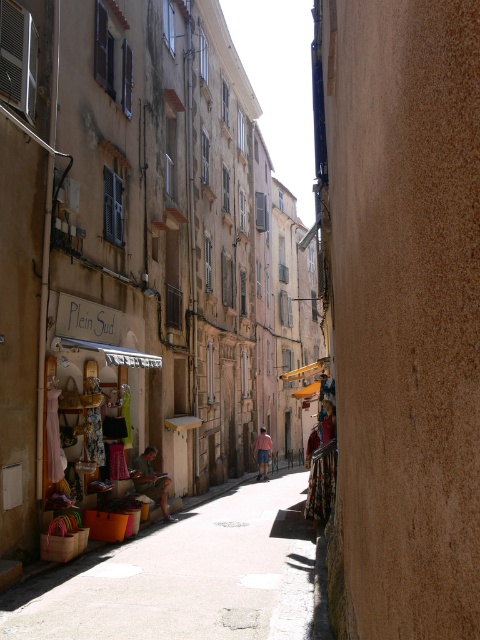
You are a tourist standing at the entrance of the street and want to pick up the pink cotton shorts at center. Is the wooden crates at lower left blocking your path to the shorts?

The wooden crates at lower left is located above the pink cotton shorts at center, so it is blocking your path to the shorts.

From the picture: You are standing at the entrance of the shop named Plein Sud. You need to place a new display stand for the shop. The display stand requires a space that is 1 meter wide. Can you determine if the area near the wooden crates at lower left has enough space for the display stand based on their 2D location coordinates?

The wooden crates at lower left are located at point (186, 577). Without additional information about the dimensions of the space or the size of the wooden crates themselves, it is impossible to determine if there is enough space for a 1 meter wide display stand.

You are a photographer standing at the end of the narrow street in the European town. You want to take a photo that includes both the point at coordinates point (454, 618) and point (76, 566). Which point should you focus on first to ensure both are in sharp focus?

You should focus on point (454, 618) first because it is closer to the camera than point (76, 566), so focusing on the closer point will ensure the farther point is also in focus.